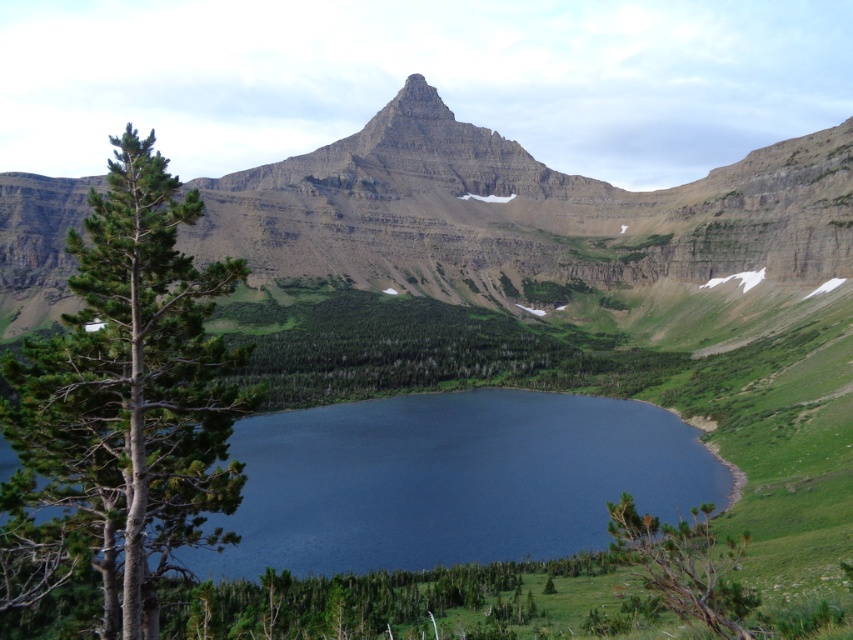
You are planning to take a photo of the rugged rock mountain at center and the deep blue water at center from a distance. Which one will occupy more space in your camera frame?

The rugged rock mountain at center will occupy more space in the camera frame because its width is larger than that of the deep blue water at center.